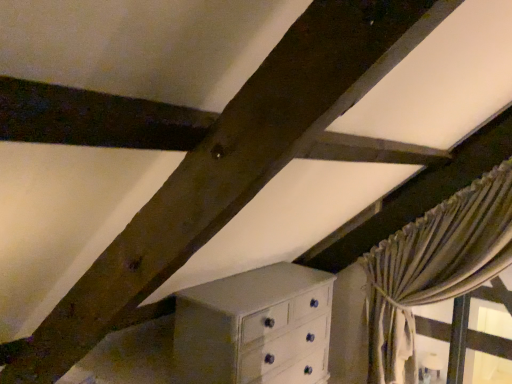
Question: Does silky beige curtain at right come in front of white painted wood chest of drawers at lower center?

Choices:
 (A) no
 (B) yes

Answer: (A)

Question: Is silky beige curtain at right positioned beyond the bounds of white painted wood chest of drawers at lower center?

Choices:
 (A) no
 (B) yes

Answer: (B)

Question: Is silky beige curtain at right far away from white painted wood chest of drawers at lower center?

Choices:
 (A) yes
 (B) no

Answer: (B)

Question: Is silky beige curtain at right next to white painted wood chest of drawers at lower center?

Choices:
 (A) yes
 (B) no

Answer: (B)

Question: Is silky beige curtain at right wider than white painted wood chest of drawers at lower center?

Choices:
 (A) yes
 (B) no

Answer: (B)

Question: Does silky beige curtain at right appear on the left side of white painted wood chest of drawers at lower center?

Choices:
 (A) yes
 (B) no

Answer: (B)

Question: Is white painted wood chest of drawers at lower center looking in the opposite direction of silky beige curtain at right?

Choices:
 (A) yes
 (B) no

Answer: (B)

Question: Does white painted wood chest of drawers at lower center lie behind silky beige curtain at right?

Choices:
 (A) no
 (B) yes

Answer: (A)

Question: Can you confirm if white painted wood chest of drawers at lower center is positioned to the left of silky beige curtain at right?

Choices:
 (A) yes
 (B) no

Answer: (A)

Question: Is white painted wood chest of drawers at lower center not near silky beige curtain at right?

Choices:
 (A) yes
 (B) no

Answer: (B)

Question: Considering the relative sizes of white painted wood chest of drawers at lower center and silky beige curtain at right in the image provided, is white painted wood chest of drawers at lower center thinner than silky beige curtain at right?

Choices:
 (A) no
 (B) yes

Answer: (A)

Question: From the image's perspective, is white painted wood chest of drawers at lower center beneath silky beige curtain at right?

Choices:
 (A) no
 (B) yes

Answer: (B)

Question: From a real-world perspective, is white painted wood chest of drawers at lower center physically located above or below silky beige curtain at right?

Choices:
 (A) below
 (B) above

Answer: (A)